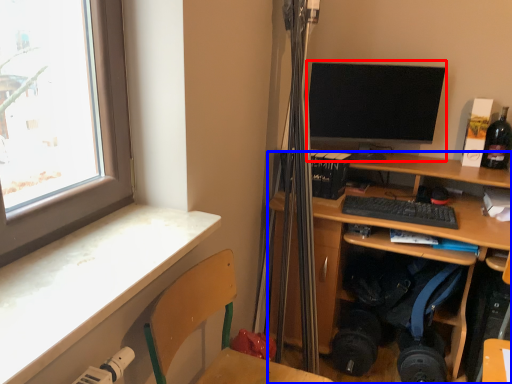
Question: Which object appears closest to the camera in this image, computer monitor (highlighted by a red box) or desk (highlighted by a blue box)?

Choices:
 (A) computer monitor
 (B) desk

Answer: (B)